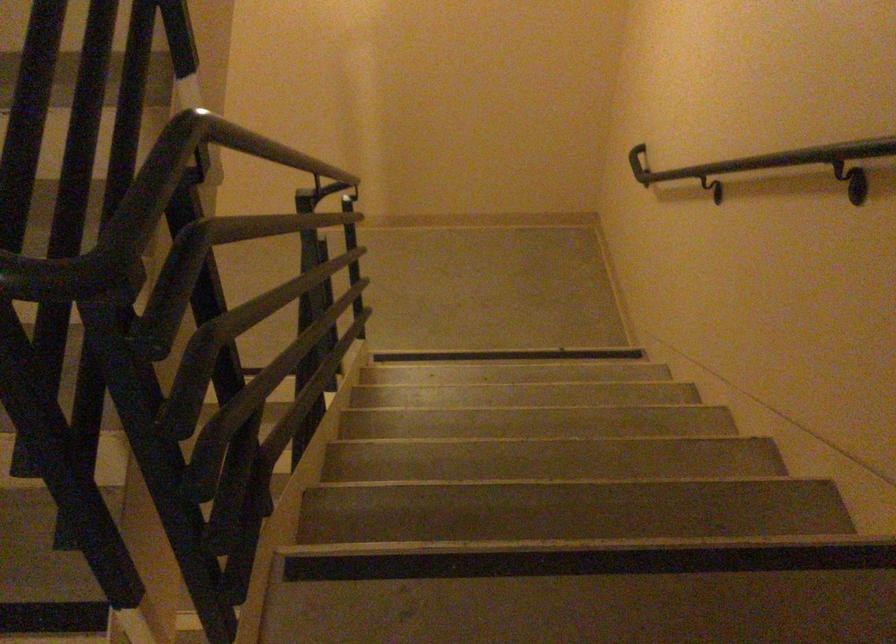
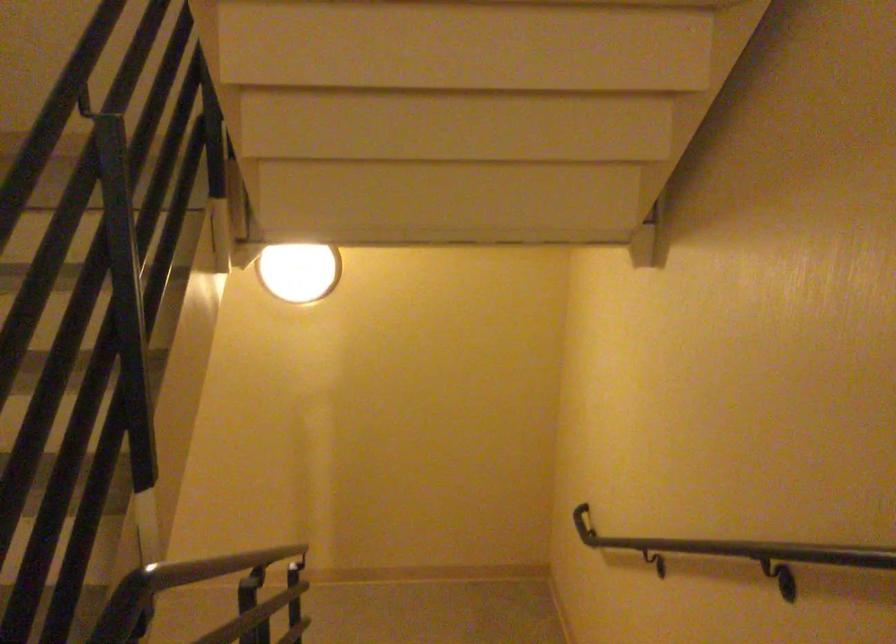
Question: The images are taken continuously from a first-person perspective. In which direction is your viewpoint rotating?

Choices:
 (A) Left
 (B) Right
 (C) Up
 (D) Down

Answer: (C)